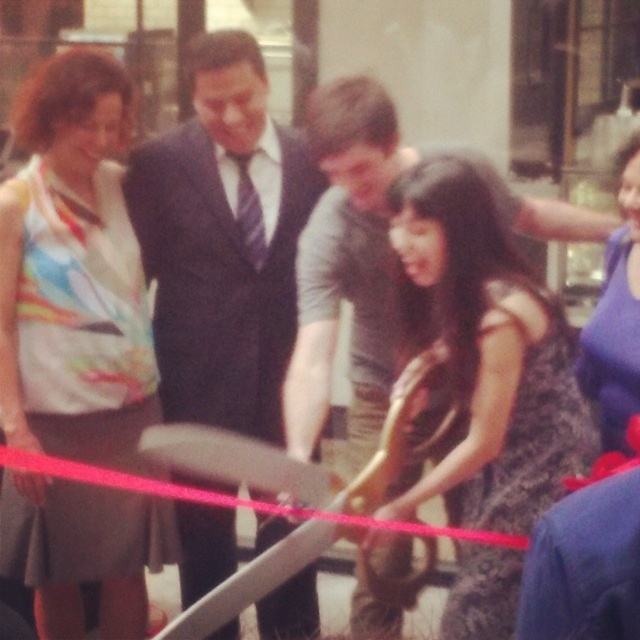
Question: Considering the real-world distances, which object is farthest from the multicolored fabric dress at left?

Choices:
 (A) dark blue suit at center
 (B) black lace dress at center

Answer: (B)

Question: Which point is farther to the camera?

Choices:
 (A) (35, 147)
 (B) (609, 294)
 (C) (500, 260)

Answer: (A)

Question: Can you confirm if multicolored fabric dress at left is bigger than dark blue suit at center?

Choices:
 (A) yes
 (B) no

Answer: (A)

Question: Where is black lace dress at center located in relation to blue satin dress at lower right in the image?

Choices:
 (A) above
 (B) below

Answer: (B)

Question: Among these points, which one is farthest from the camera?

Choices:
 (A) (516, 340)
 (B) (170, 145)
 (C) (108, 337)

Answer: (B)

Question: Can you confirm if multicolored fabric dress at left is thinner than dark blue suit at center?

Choices:
 (A) yes
 (B) no

Answer: (A)